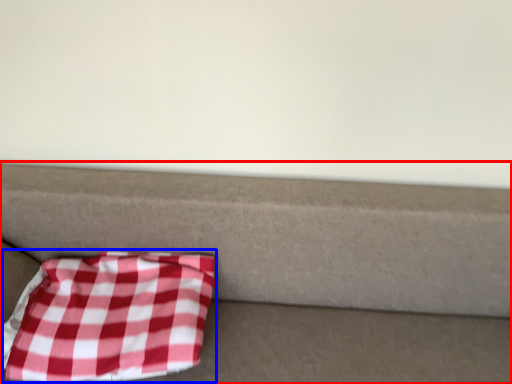
Question: Which point is further to the camera, furniture (highlighted by a red box) or blanket (highlighted by a blue box)?

Choices:
 (A) furniture
 (B) blanket

Answer: (B)